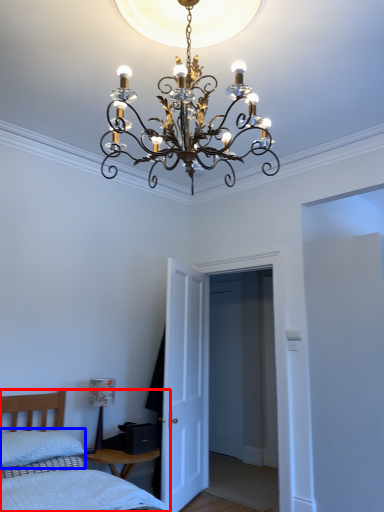
Question: Which of the following is the closest to the observer, bed (highlighted by a red box) or pillow (highlighted by a blue box)?

Choices:
 (A) bed
 (B) pillow

Answer: (A)